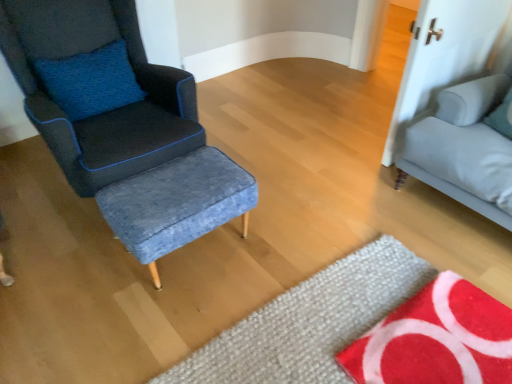
Find the location of a particular element. This screenshot has height=384, width=512. matte blue fabric chair at left is located at coordinates tap(121, 124).

Where is `denim fabric stool at center`? The width and height of the screenshot is (512, 384). denim fabric stool at center is located at coordinates (177, 203).

Which is behind, point (460, 142) or point (225, 172)?

The point (460, 142) is behind.

Which object is positioned more to the right, light gray fabric studio couch at right or denim fabric stool at center?

light gray fabric studio couch at right.

From a real-world perspective, which object rests below the other?

denim fabric stool at center, from a real-world perspective.

Does light gray fabric studio couch at right have a lesser width compared to denim fabric stool at center?

In fact, light gray fabric studio couch at right might be wider than denim fabric stool at center.

Considering the sizes of objects red textured mat at lower right, acting as the second mat starting from the left, and denim fabric stool at center in the image provided, who is shorter, red textured mat at lower right, acting as the second mat starting from the left, or denim fabric stool at center?

With less height is red textured mat at lower right, acting as the second mat starting from the left.

Is red textured mat at lower right, the first mat positioned from the right, aimed at denim fabric stool at center?

No, red textured mat at lower right, the first mat positioned from the right, is not oriented towards denim fabric stool at center.

Is red textured mat at lower right, the first mat positioned from the right, in front of or behind denim fabric stool at center in the image?

In the image, red textured mat at lower right, the first mat positioned from the right, appears in front of denim fabric stool at center.

From a real-world perspective, between red textured mat at lower right, the first mat positioned from the right, and denim fabric stool at center, who is vertically higher?

denim fabric stool at center.

Considering the positions of objects matte blue fabric chair at left and light gray fabric studio couch at right in the image provided, who is more to the right, matte blue fabric chair at left or light gray fabric studio couch at right?

light gray fabric studio couch at right is more to the right.

Considering the positions of objects matte blue fabric chair at left and light gray fabric studio couch at right in the image provided, who is in front, matte blue fabric chair at left or light gray fabric studio couch at right?

matte blue fabric chair at left is more forward.

Consider the image. From a real-world perspective, does matte blue fabric chair at left stand above light gray fabric studio couch at right?

Yes.

Does matte blue fabric chair at left turn towards light gray fabric studio couch at right?

No, matte blue fabric chair at left does not turn towards light gray fabric studio couch at right.

Locate an element on the screen. studio couch above the red textured mat at lower right, acting as the second mat starting from the left (from the image's perspective) is located at coordinates (464, 149).

Considering the positions of objects light gray fabric studio couch at right and red textured mat at lower right, the first mat positioned from the right, in the image provided, who is behind, light gray fabric studio couch at right or red textured mat at lower right, the first mat positioned from the right,?

light gray fabric studio couch at right is behind.

From the image's perspective, which object appears higher, light gray fabric studio couch at right or red textured mat at lower right, acting as the second mat starting from the left?

light gray fabric studio couch at right.

Relative to light gray fabric studio couch at right, is red textured mat at lower right, the first mat positioned from the right, in front or behind?

Visually, red textured mat at lower right, the first mat positioned from the right, is located in front of light gray fabric studio couch at right.

Could you tell me if red textured mat at lower right, the first mat positioned from the right, is turned towards light gray fabric studio couch at right?

No, red textured mat at lower right, the first mat positioned from the right, is not oriented towards light gray fabric studio couch at right.

Is red textured mat at lower right, the first mat positioned from the right, with light gray fabric studio couch at right?

red textured mat at lower right, the first mat positioned from the right, is not next to light gray fabric studio couch at right, and they're not touching.

From a real-world perspective, between red textured mat at lower right, acting as the second mat starting from the left, and light gray fabric studio couch at right, who is vertically higher?

light gray fabric studio couch at right is physically above.

Is denim fabric stool at center located outside textured wool mat at lower center, positioned as the 1th mat in left-to-right order?

Yes, denim fabric stool at center is located beyond the bounds of textured wool mat at lower center, positioned as the 1th mat in left-to-right order.

How many degrees apart are the facing directions of denim fabric stool at center and textured wool mat at lower center, positioned as the 2th mat in right-to-left order?

denim fabric stool at center and textured wool mat at lower center, positioned as the 2th mat in right-to-left order, are facing 89.1 degrees away from each other.

Considering the sizes of objects denim fabric stool at center and textured wool mat at lower center, positioned as the 1th mat in left-to-right order, in the image provided, who is thinner, denim fabric stool at center or textured wool mat at lower center, positioned as the 1th mat in left-to-right order,?

denim fabric stool at center.

From a real-world perspective, is denim fabric stool at center physically below textured wool mat at lower center, positioned as the 1th mat in left-to-right order?

No, from a real-world perspective, denim fabric stool at center is not beneath textured wool mat at lower center, positioned as the 1th mat in left-to-right order.

Considering the relative sizes of textured wool mat at lower center, positioned as the 2th mat in right-to-left order, and matte blue fabric chair at left in the image provided, is textured wool mat at lower center, positioned as the 2th mat in right-to-left order, taller than matte blue fabric chair at left?

Incorrect, the height of textured wool mat at lower center, positioned as the 2th mat in right-to-left order, is not larger of that of matte blue fabric chair at left.

Considering the positions of objects textured wool mat at lower center, positioned as the 2th mat in right-to-left order, and matte blue fabric chair at left in the image provided, who is in front, textured wool mat at lower center, positioned as the 2th mat in right-to-left order, or matte blue fabric chair at left?

textured wool mat at lower center, positioned as the 2th mat in right-to-left order.

Which point is more forward, (393, 300) or (243, 211)?

The point (393, 300) is closer.

This screenshot has height=384, width=512. I want to click on studio couch in front of the denim fabric stool at center, so click(x=464, y=149).

At what (x,y) coordinates should I click in order to perform the action: click on stool that appears behind the red textured mat at lower right, the first mat positioned from the right. Please return your answer as a coordinate pair (x, y). Image resolution: width=512 pixels, height=384 pixels. Looking at the image, I should click on (177, 203).

Looking at this image, from the image, which object appears to be nearer to textured wool mat at lower center, positioned as the 1th mat in left-to-right order, matte blue fabric chair at left or denim fabric stool at center?

denim fabric stool at center is positioned closer to the anchor textured wool mat at lower center, positioned as the 1th mat in left-to-right order.

Looking at the image, which one is located closer to textured wool mat at lower center, positioned as the 1th mat in left-to-right order, red textured mat at lower right, acting as the second mat starting from the left, or denim fabric stool at center?

Based on the image, red textured mat at lower right, acting as the second mat starting from the left, appears to be nearer to textured wool mat at lower center, positioned as the 1th mat in left-to-right order.

From the image, which object appears to be nearer to textured wool mat at lower center, positioned as the 2th mat in right-to-left order, denim fabric stool at center or red textured mat at lower right, the first mat positioned from the right?

red textured mat at lower right, the first mat positioned from the right, lies closer to textured wool mat at lower center, positioned as the 2th mat in right-to-left order, than the other object.

When comparing their distances from textured wool mat at lower center, positioned as the 2th mat in right-to-left order, does denim fabric stool at center or matte blue fabric chair at left seem closer?

The object closer to textured wool mat at lower center, positioned as the 2th mat in right-to-left order, is denim fabric stool at center.

Which object lies nearer to the anchor point denim fabric stool at center, red textured mat at lower right, acting as the second mat starting from the left, or light gray fabric studio couch at right?

red textured mat at lower right, acting as the second mat starting from the left, is closer to denim fabric stool at center.

Looking at the image, which one is located further to light gray fabric studio couch at right, matte blue fabric chair at left or denim fabric stool at center?

matte blue fabric chair at left.

Which object lies further to the anchor point textured wool mat at lower center, positioned as the 2th mat in right-to-left order, red textured mat at lower right, acting as the second mat starting from the left, or light gray fabric studio couch at right?

Among the two, light gray fabric studio couch at right is located further to textured wool mat at lower center, positioned as the 2th mat in right-to-left order.

Considering their positions, is matte blue fabric chair at left positioned further to denim fabric stool at center than textured wool mat at lower center, positioned as the 2th mat in right-to-left order?

Based on the image, textured wool mat at lower center, positioned as the 2th mat in right-to-left order, appears to be further to denim fabric stool at center.

Where is `stool located between matte blue fabric chair at left and light gray fabric studio couch at right in the left-right direction`? This screenshot has width=512, height=384. stool located between matte blue fabric chair at left and light gray fabric studio couch at right in the left-right direction is located at coordinates (177, 203).

Locate an element on the screen. mat between matte blue fabric chair at left and red textured mat at lower right, acting as the second mat starting from the left, from left to right is located at coordinates pyautogui.click(x=309, y=322).

The height and width of the screenshot is (384, 512). What are the coordinates of `mat between denim fabric stool at center and red textured mat at lower right, the first mat positioned from the right` in the screenshot? It's located at (309, 322).

This screenshot has height=384, width=512. I want to click on stool between matte blue fabric chair at left and red textured mat at lower right, the first mat positioned from the right, from left to right, so click(177, 203).